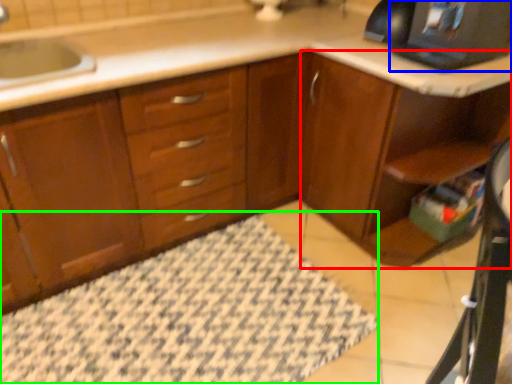
Question: Which object is positioned closest to dresser (highlighted by a red box)? Select from desktop computer (highlighted by a blue box) and bath mat (highlighted by a green box).

Choices:
 (A) desktop computer
 (B) bath mat

Answer: (A)